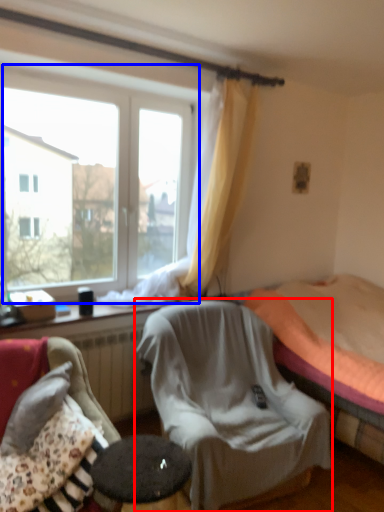
Question: Which object appears farthest to the camera in this image, chair (highlighted by a red box) or window (highlighted by a blue box)?

Choices:
 (A) chair
 (B) window

Answer: (B)